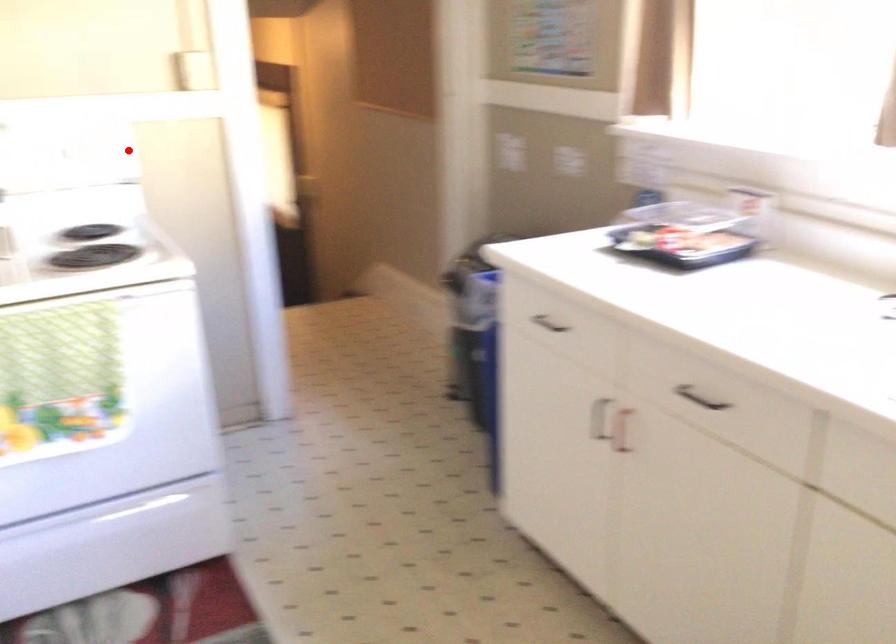
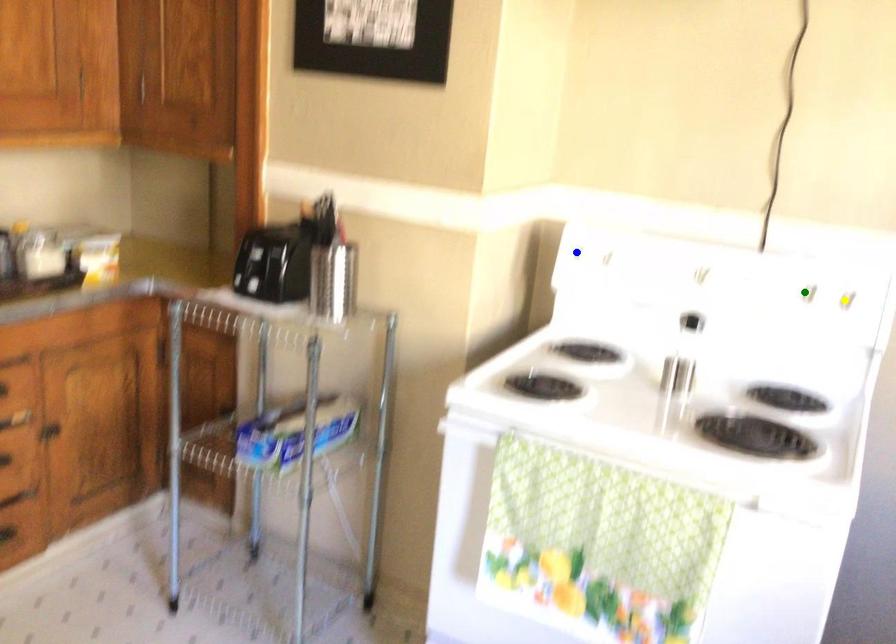
Question: I am providing you with two images of the same scene from different viewpoints. A red point is marked on the first image. You are given multiple points on the second image. Which point in image 2 represents the same 3d spot as the red point in image 1?

Choices:
 (A) blue point
 (B) green point
 (C) yellow point

Answer: (C)